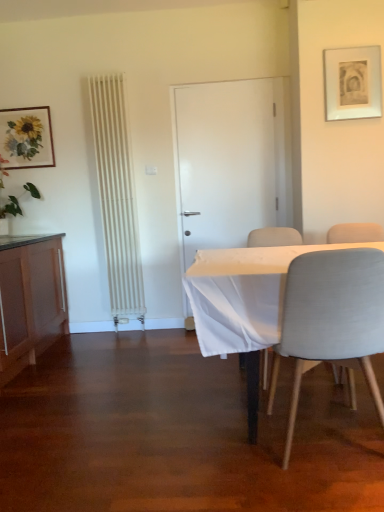
Question: Considering the positions of matte wood cabinet at left and green leafy plant at left in the image, is matte wood cabinet at left bigger or smaller than green leafy plant at left?

Choices:
 (A) big
 (B) small

Answer: (A)

Question: Do you think matte wood cabinet at left is within green leafy plant at left, or outside of it?

Choices:
 (A) outside
 (B) inside

Answer: (A)

Question: Considering the real-world distances, which object is closest to the light gray fabric chair at center, the third chair in the front-to-back sequence?

Choices:
 (A) light gray fabric chair at right, the second chair positioned from the back
 (B) light gray fabric chair at lower right, the 1th chair in the front-to-back sequence
 (C) matte wood cabinet at left
 (D) matte white picture frame at upper right, which ranks as the 1th picture frame in right-to-left order
 (E) matte wooden picture frame at upper left, arranged as the 1th picture frame when viewed from the left

Answer: (A)

Question: Considering the real-world distances, which object is closest to the matte wood cabinet at left?

Choices:
 (A) light gray fabric chair at right, the second chair positioned from the back
 (B) white matte door at center
 (C) matte white picture frame at upper right, the 2th picture frame in the left-to-right sequence
 (D) green leafy plant at left
 (E) light gray fabric chair at center, the third chair in the front-to-back sequence

Answer: (D)